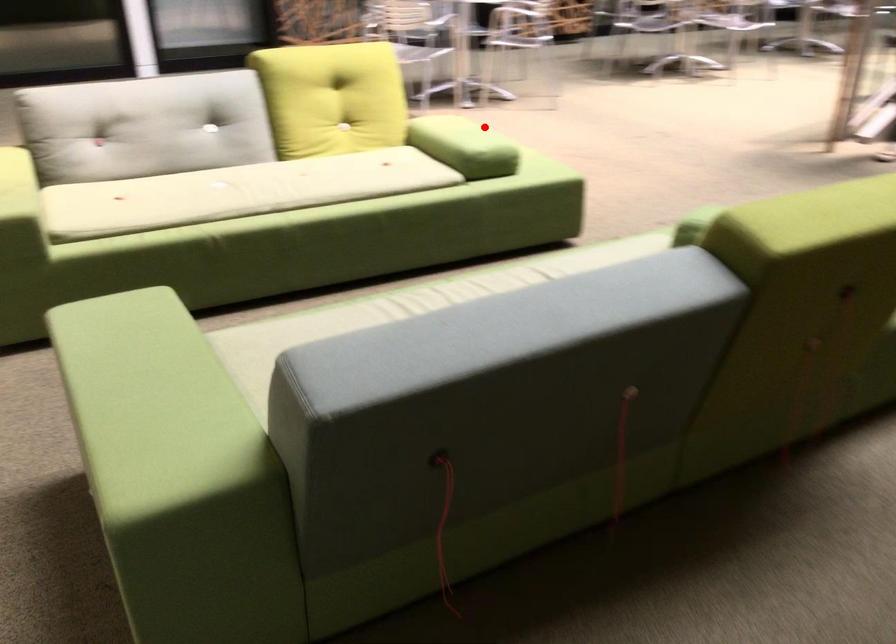
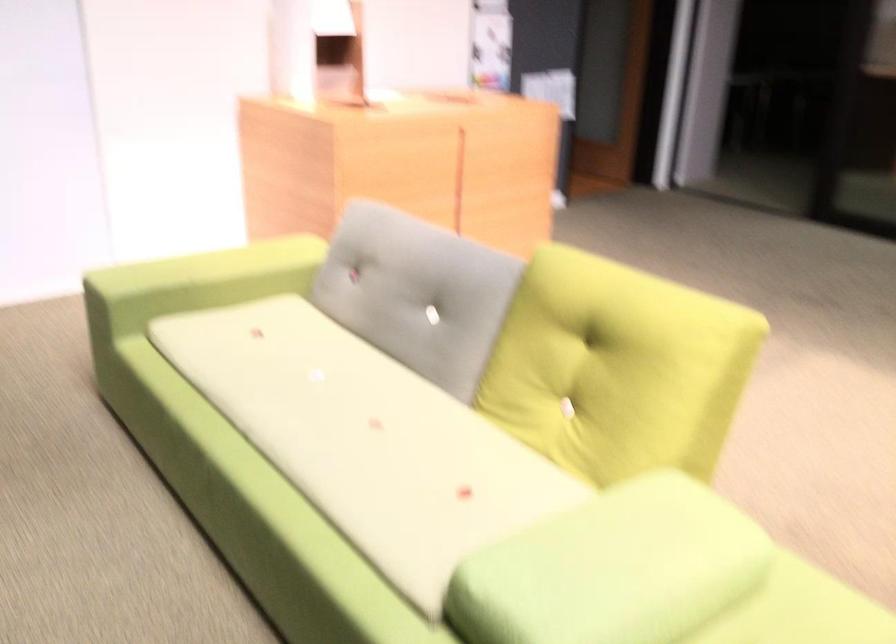
The point at the highlighted location is marked in the first image. Where is the corresponding point in the second image?

(613, 569)